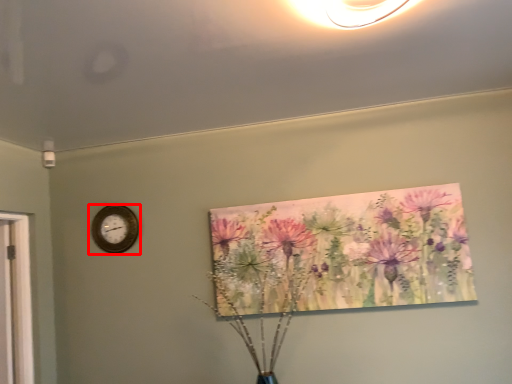
Question: Observing the image, what is the correct spatial positioning of wall clock (annotated by the red box) in reference to floral arrangement?

Choices:
 (A) left
 (B) right

Answer: (A)